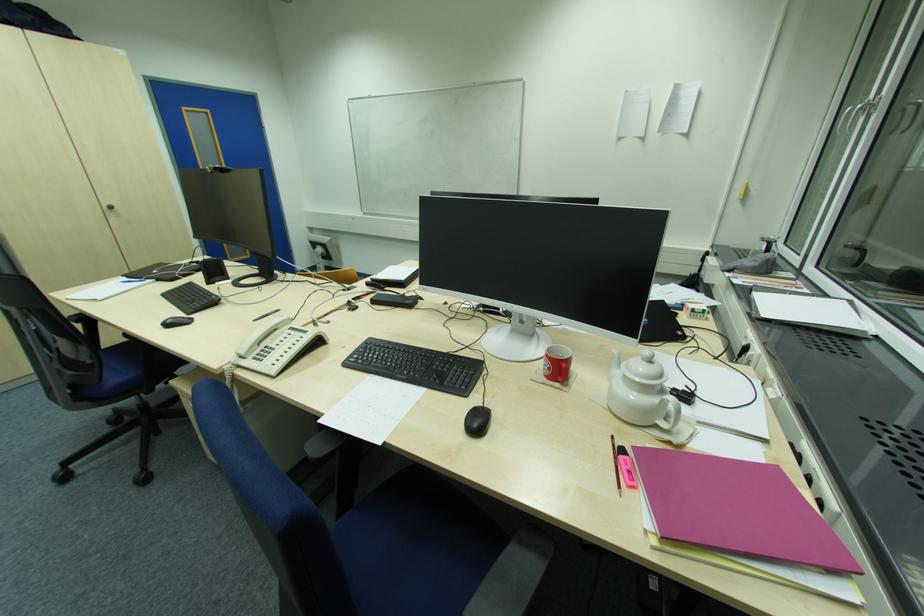
Where would you sit the black chair sitting surface? Please return your answer as a coordinate pair (x, y).

(176, 322)